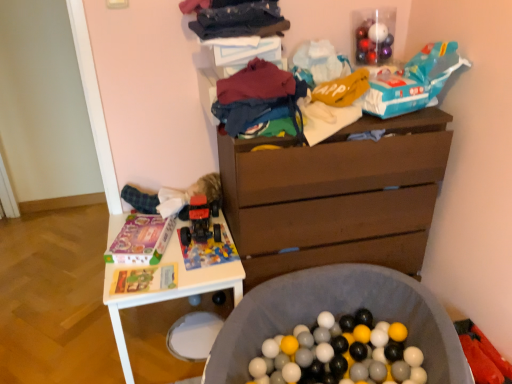
Where is `vacant space underneath brick-patterned plastic toy car at center, which appears as the second toy when viewed from the right (from a real-world perspective)`? vacant space underneath brick-patterned plastic toy car at center, which appears as the second toy when viewed from the right (from a real-world perspective) is located at coordinates (208, 258).